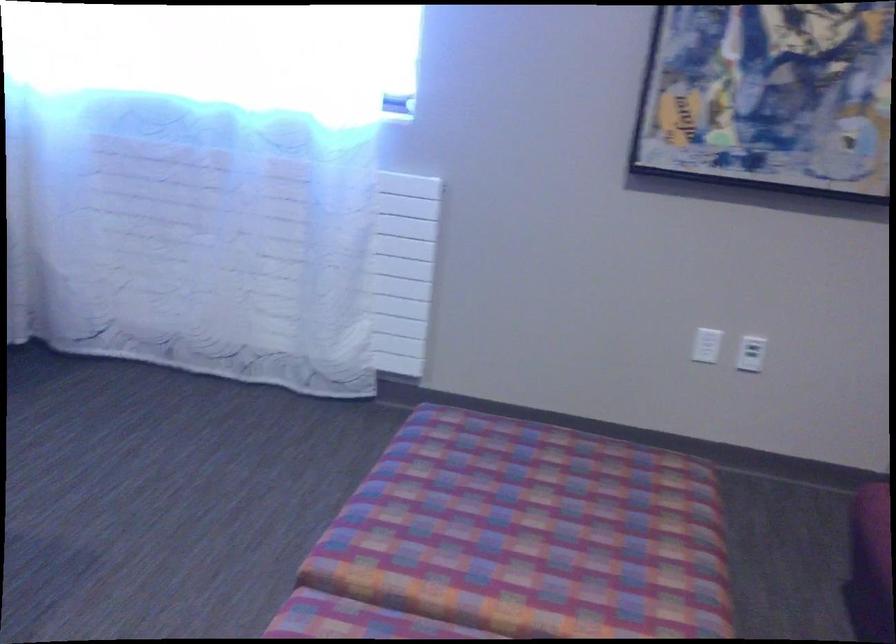
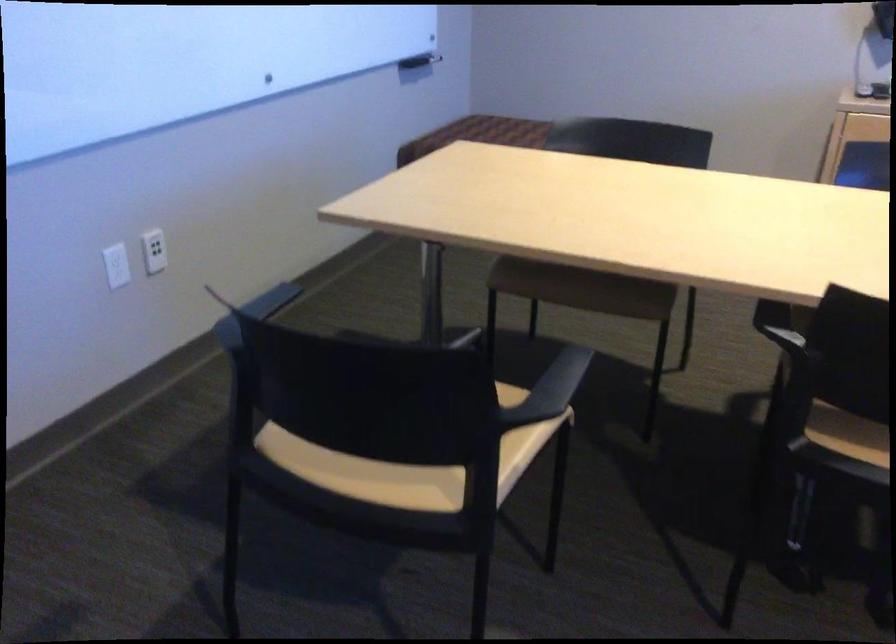
How did the camera likely rotate?

The camera's rotation is toward left-down.